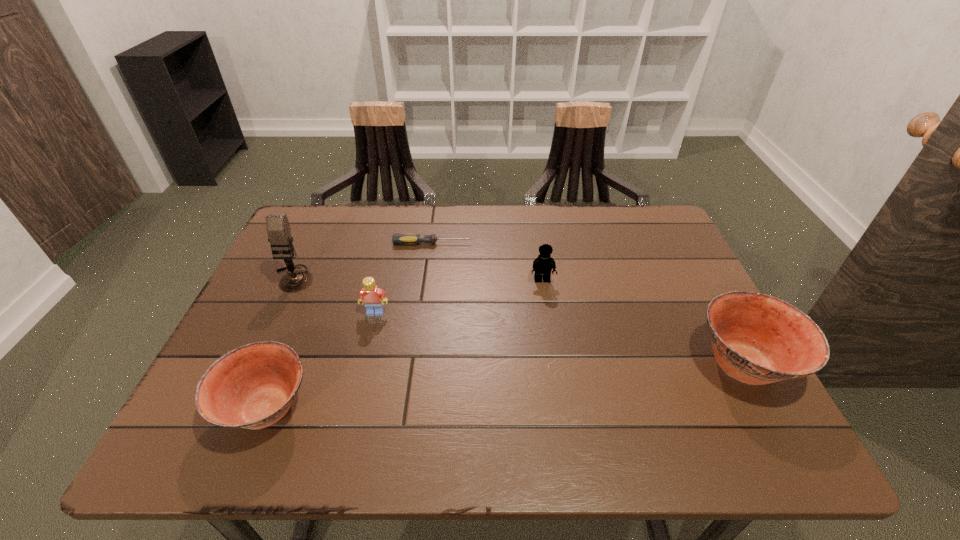
Where is `vacant spot for a new bowl to ensure equal spacing`? This screenshot has width=960, height=540. vacant spot for a new bowl to ensure equal spacing is located at coordinates (516, 386).